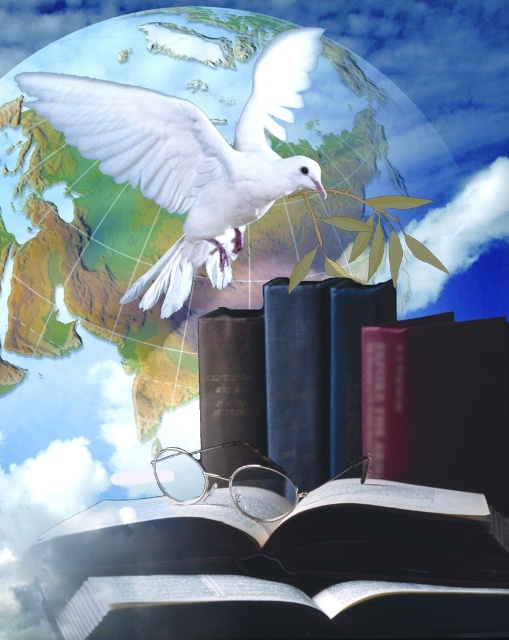
You are an art curator examining the composite artwork. You notice the matte black book at center and the white matte dove at upper center. Which object is closer to the viewer?

The matte black book at center is closer to the viewer than the white matte dove at upper center because it is positioned in front of it.

You are an art curator planning to install a spotlight at coordinate point (270, 547) in the artwork. The spotlight has a narrow beam that will only illuminate the object directly at that coordinate. Which object will be highlighted by the spotlight?

The point at coordinate (270, 547) indicates the matte black book at center, so the spotlight will highlight the matte black book at center.